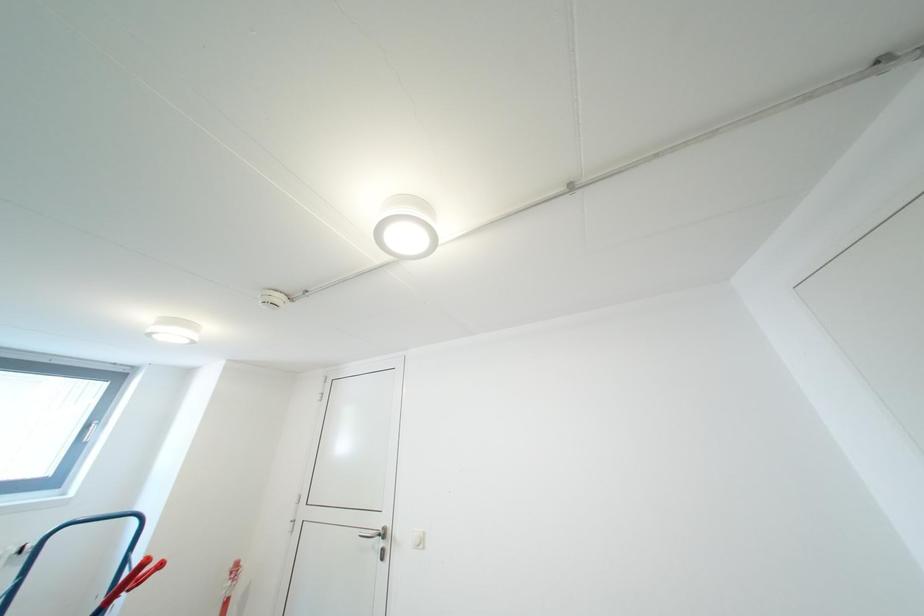
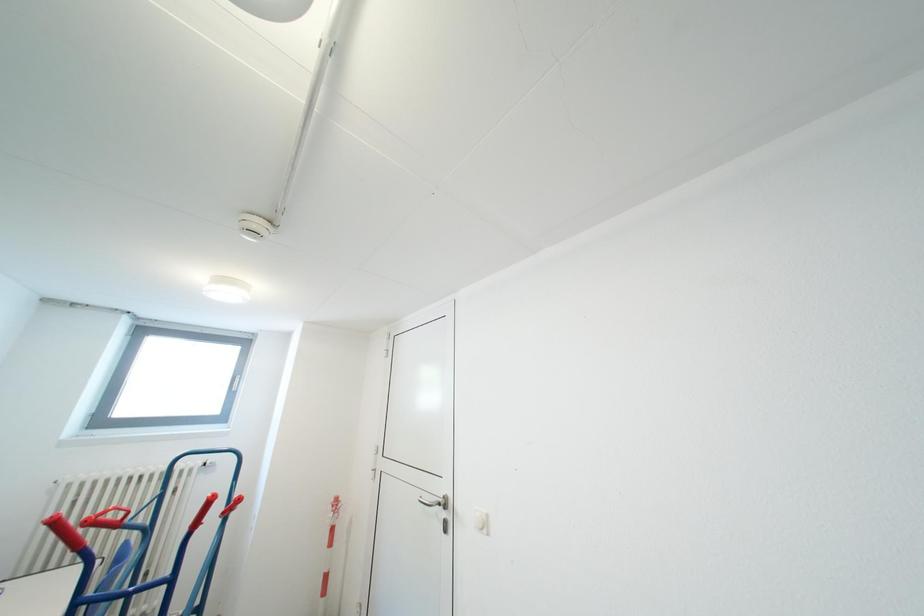
Question: Based on the continuous images, in which direction is the camera rotating? Reply with the corresponding letter.

Choices:
 (A) Left
 (B) Right
 (C) Up
 (D) Down

Answer: (A)